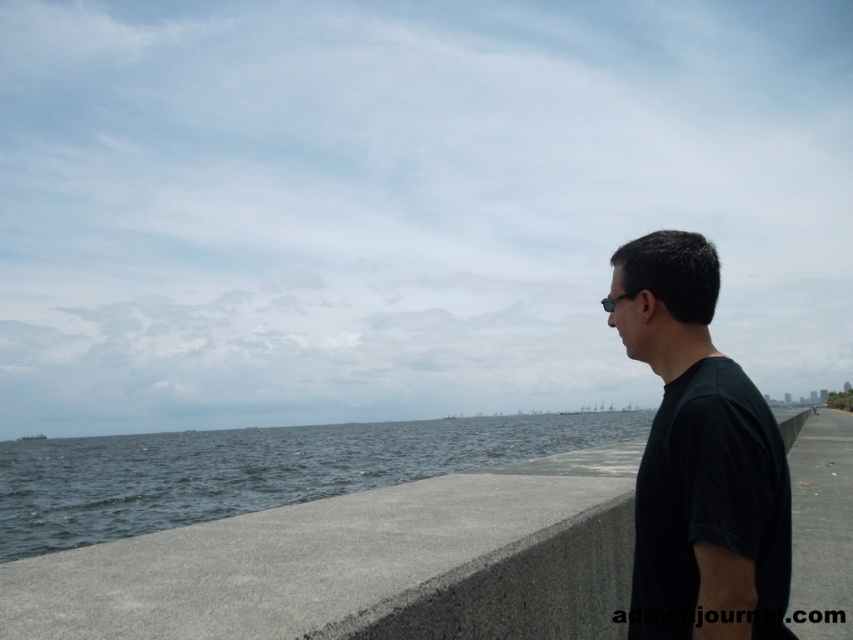
You are a photographer planning to capture the scene with the gray concrete ledge at center and the black matte shirt at right. Which object should you focus on first if you want to highlight the larger object in your shot?

You should focus on the gray concrete ledge at center first because it is larger than the black matte shirt at right.

You are a photographer trying to capture the gray concrete ledge at center and the black matte shirt at right in the same frame. Which object should you focus on first to ensure both are in the frame without moving the camera?

You should focus on the gray concrete ledge at center first because it is wider than the black matte shirt at right, ensuring it fits within the frame.

You are standing on the concrete walkway and want to place a small potted plant exactly at the point marked by the coordinates point [361,564]. According to the scene description, where should you place the potted plant?

The point [361,564] indicates the gray concrete ledge at center, so you should place the potted plant on the gray concrete ledge at center.